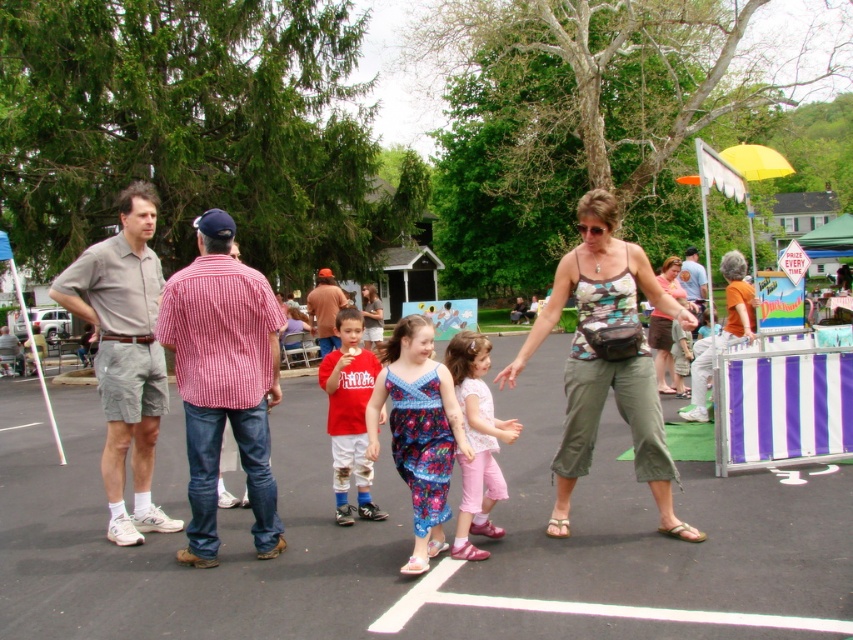
You are a photographer trying to capture a candid shot of the two people in the scene. The camera you are using has a maximum focus range of 3 feet. Can you take a photo of both the camouflage tank top at center and the floral fabric dress at center in the same frame without moving the camera?

The camouflage tank top at center and floral fabric dress at center are 3.47 feet apart from each other. Since the camera can only focus within 3 feet, the distance between them exceeds the focus range. Therefore, you cannot capture both in sharp focus simultaneously without moving the camera.